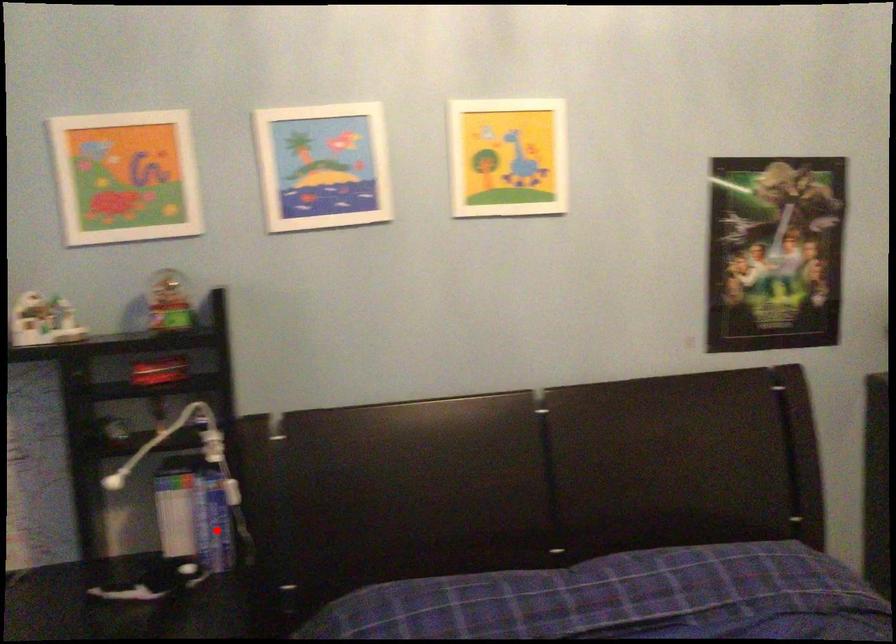
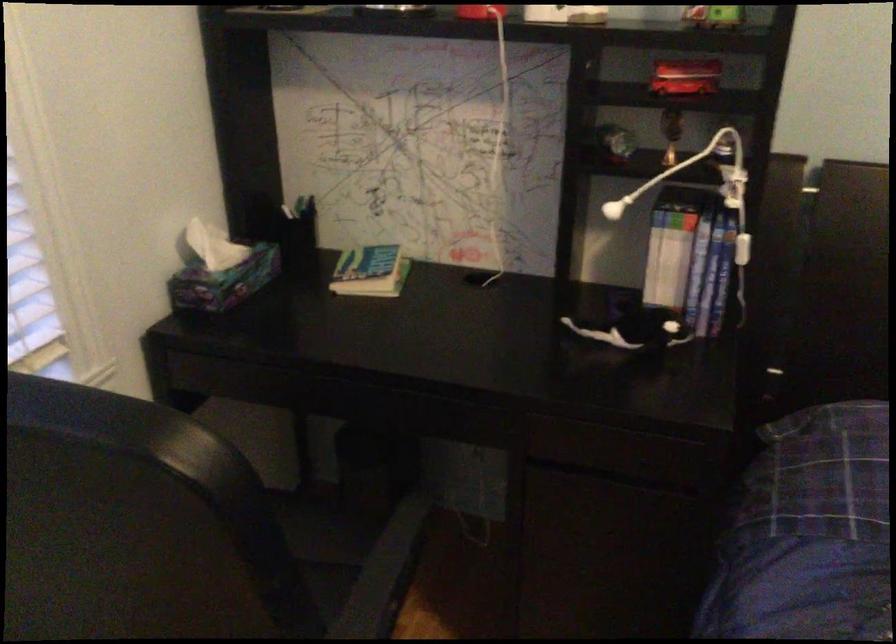
Question: I am providing you with two images of the same scene from different viewpoints. In image1, a red point is highlighted. Considering the same 3D point in image2, which of the following is correct?

Choices:
 (A) It is closer
 (B) It is farther

Answer: (A)